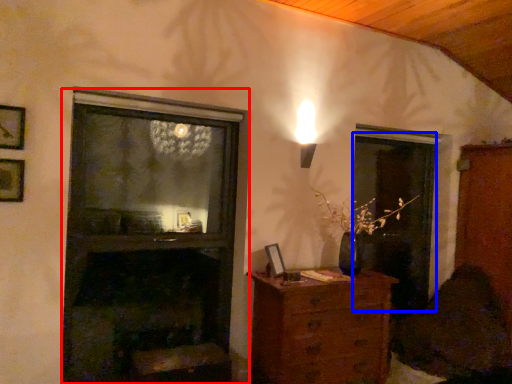
Question: Which of the following is the closest to the observer, fireplace (highlighted by a red box) or screen door (highlighted by a blue box)?

Choices:
 (A) fireplace
 (B) screen door

Answer: (A)